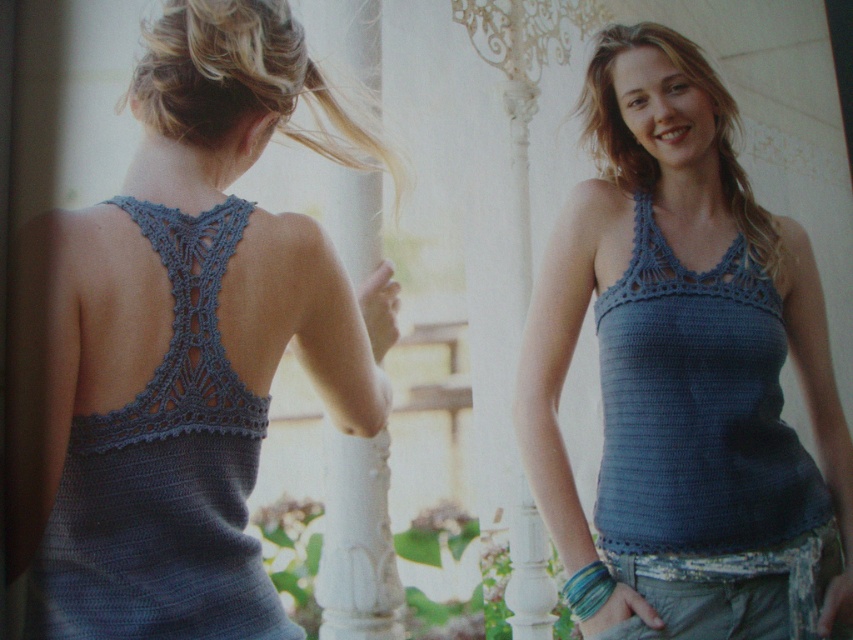
Looking at the two people in the scene, which object is positioned to the right of the other between the blue knitted tank top at center and the blonde hair at upper center?

The blue knitted tank top at center is positioned to the right of the blonde hair at upper center.

You are a fashion designer trying to decide which top to feature in your new collection. Both the blue knitted tank top at center and the denim crochet halter top at center are candidates. Based on their sizes, which top has a wider silhouette?

The blue knitted tank top at center has a larger width than the denim crochet halter top at center, making it the wider option.